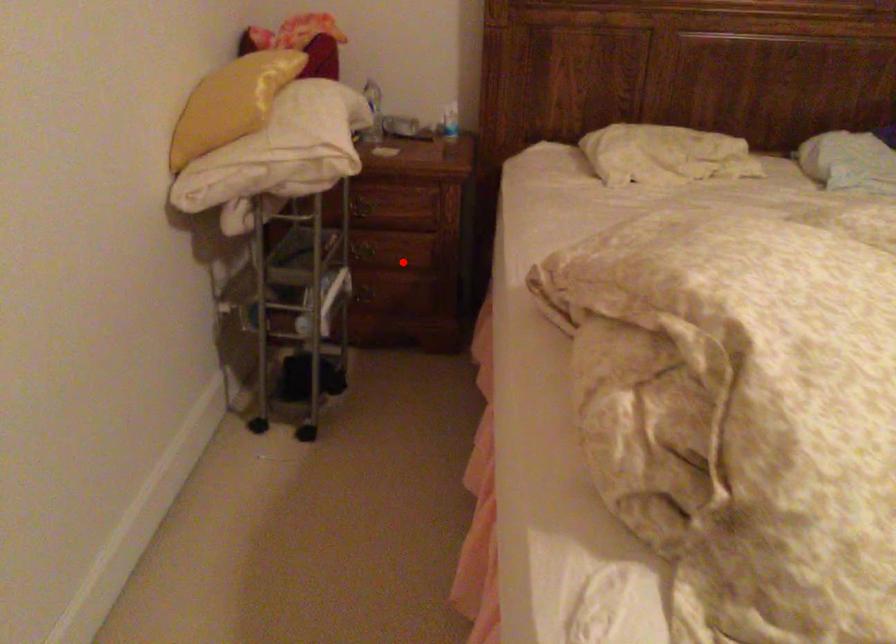
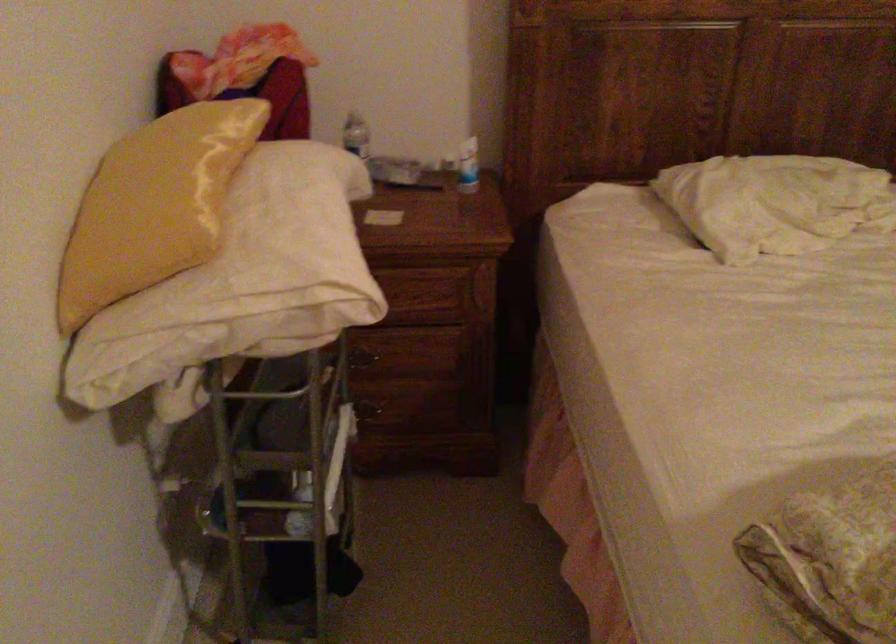
In the second image, find the point that corresponds to the highlighted location in the first image.

(412, 365)